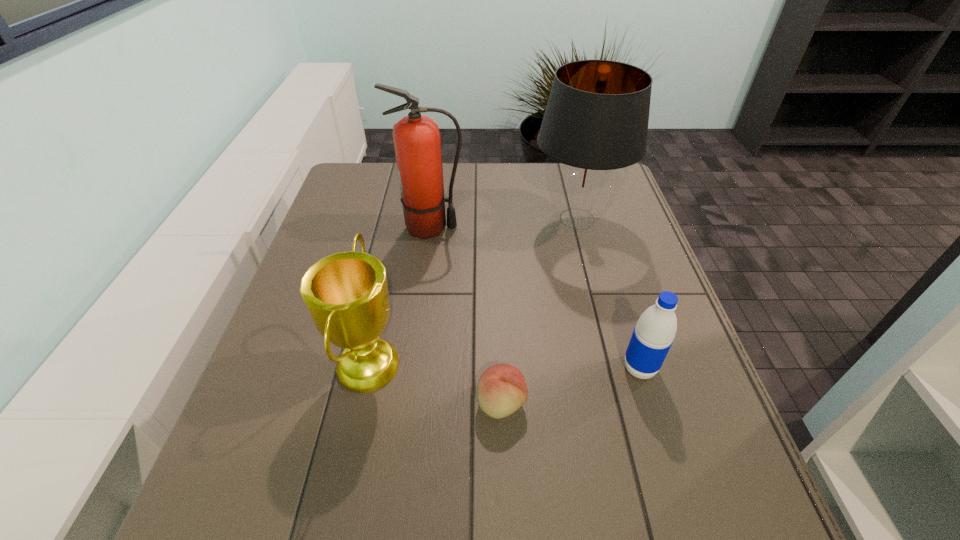
Locate an element on the screen. This screenshot has height=540, width=960. lampshade is located at coordinates (595, 125).

This screenshot has height=540, width=960. In order to click on fire extinguisher in this screenshot , I will do `click(417, 142)`.

Identify the location of the third tallest object. This screenshot has width=960, height=540. (346, 294).

This screenshot has width=960, height=540. Find the location of `the fourth tallest object`. the fourth tallest object is located at coordinates (x=653, y=335).

At what (x,y) coordinates should I click in order to perform the action: click on the third object from right to left. Please return your answer as a coordinate pair (x, y). The width and height of the screenshot is (960, 540). Looking at the image, I should click on (502, 389).

At what (x,y) coordinates should I click in order to perform the action: click on the shortest object. Please return your answer as a coordinate pair (x, y). The image size is (960, 540). Looking at the image, I should click on (502, 389).

This screenshot has width=960, height=540. I want to click on vacant position located 0.110m on the back of the lampshade, so click(x=565, y=174).

Locate an element on the screen. This screenshot has height=540, width=960. free spot located on the nozzle of the fire extinguisher is located at coordinates (482, 228).

Locate an element on the screen. This screenshot has width=960, height=540. free location located 0.250m on the shiny surface of the third shortest object is located at coordinates (521, 363).

Image resolution: width=960 pixels, height=540 pixels. I want to click on free space located on the back of the water bottle, so click(604, 253).